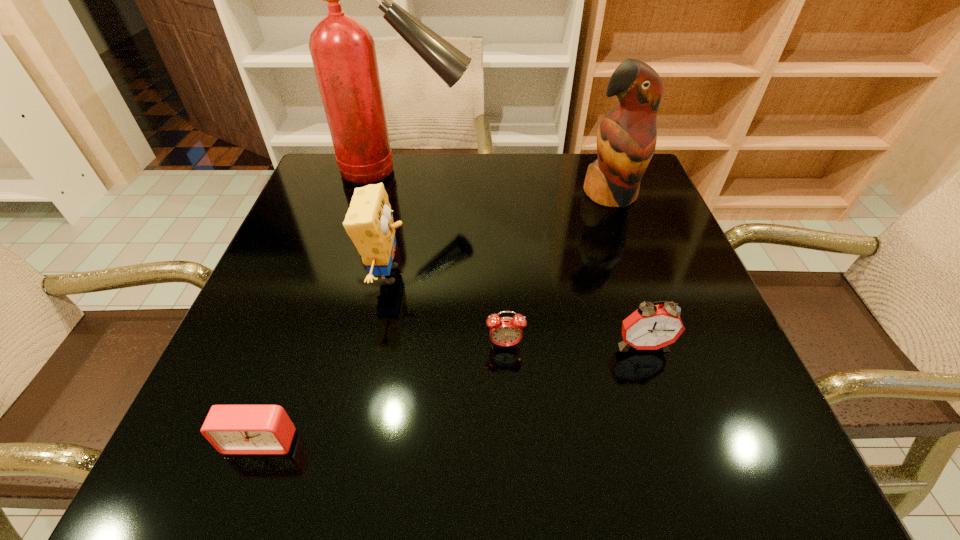
Where is `alarm clock located in the right edge section of the desktop`? alarm clock located in the right edge section of the desktop is located at coordinates (651, 327).

The image size is (960, 540). What are the coordinates of `object present at the far left corner` in the screenshot? It's located at (343, 53).

You are a GUI agent. You are given a task and a screenshot of the screen. Output one action in this format:
    pyautogui.click(x=<x>, y=<y>)
    Task: Click on the object situated at the near left corner
    
    Given the screenshot: What is the action you would take?
    pyautogui.click(x=232, y=429)

Locate an element on the screen. object that is at the far right corner is located at coordinates [x=626, y=138].

The image size is (960, 540). Find the location of `free point at the far edge`. free point at the far edge is located at coordinates [422, 186].

Find the location of a particular element. The width and height of the screenshot is (960, 540). vacant area at the near edge is located at coordinates (482, 430).

You are a GUI agent. You are given a task and a screenshot of the screen. Output one action in this format:
    pyautogui.click(x=<x>, y=<y>)
    Task: Click on the free space at the left edge
    The image size is (960, 540).
    Given the screenshot: What is the action you would take?
    pyautogui.click(x=324, y=305)

In the image, there is a desktop. Where is `vacant region at the right edge`? This screenshot has width=960, height=540. vacant region at the right edge is located at coordinates (606, 239).

Where is `vacant area at the near right corner of the desktop`? vacant area at the near right corner of the desktop is located at coordinates (748, 434).

Identify the location of empty space that is in between the fourth object from left to right and the leftmost alarm clock. (383, 393).